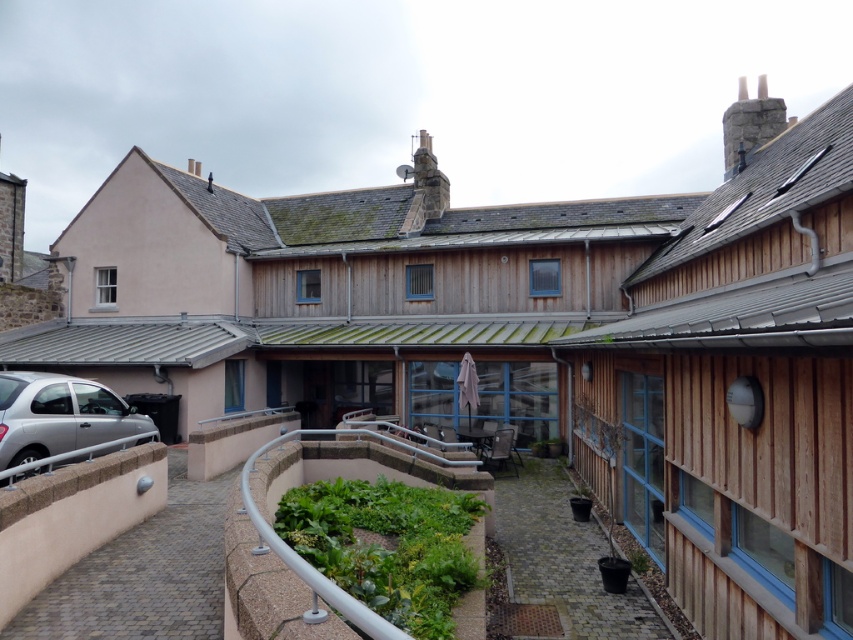
Question: Does green leafy plants at center have a smaller size compared to silver metallic car at lower left?

Choices:
 (A) no
 (B) yes

Answer: (B)

Question: Does green leafy plants at center lie in front of silver metallic car at lower left?

Choices:
 (A) no
 (B) yes

Answer: (B)

Question: Which of the following is the farthest from the observer?

Choices:
 (A) (50, 401)
 (B) (357, 492)

Answer: (A)

Question: Does green leafy plants at center have a greater width compared to silver metallic car at lower left?

Choices:
 (A) no
 (B) yes

Answer: (B)